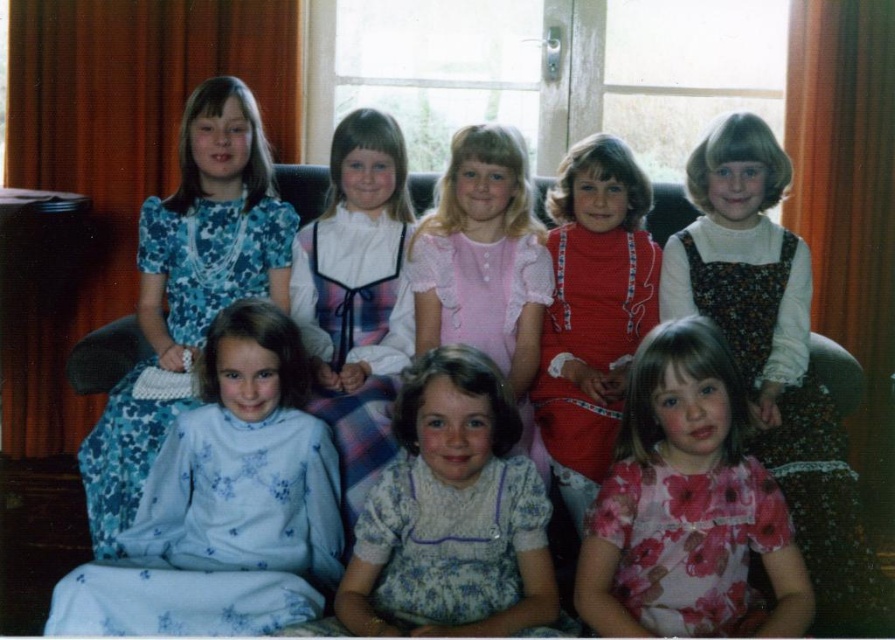
You are a photographer setting up a shoot in this living room. You need to position a backdrop that is 1.2 meters wide. The backdrop must be placed between the red knit dress at center and the white satin dress at center so that it doesn

The red knit dress at center is taller than the white satin dress at center, so positioning the backdrop between them would require ensuring it accommodates the height difference. Since the backdrop is 1.2 meters wide, it should fit as the distance between the two dresses is likely sufficient, but the height adjustment might be needed for the taller red knit dress at center.

You are standing in the living room and see two points marked on the floor. The first point is at coordinate point(249, 612) and the second point is at coordinate point(292, 182). Which point is closer to you?

Point(249, 612) is in front of point(292, 182), so it is closer to you.